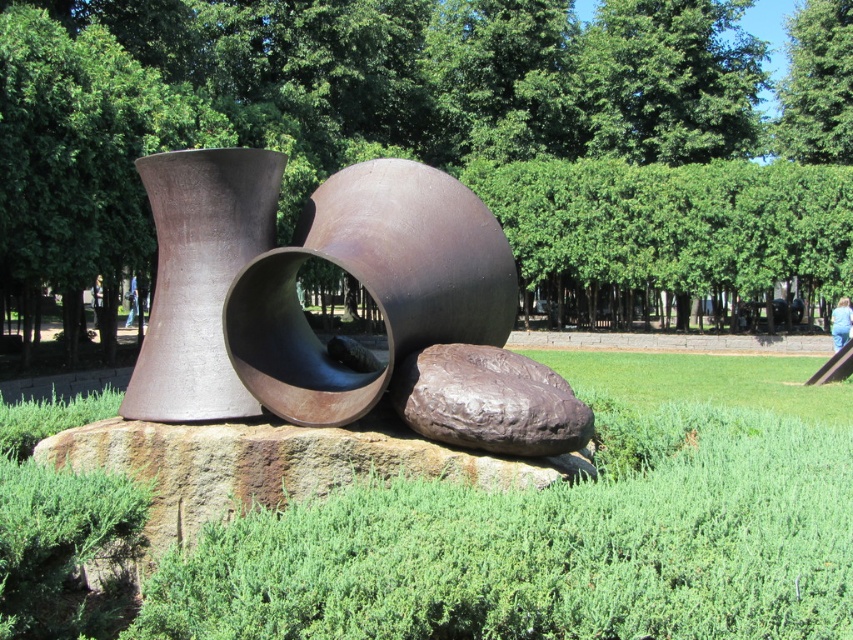
Question: Estimate the real-world distances between objects in this image. Which object is closer to the rusty metal sphere at center?

Choices:
 (A) green leafy tree at center
 (B) matte brown vase at center
 (C) green leafy tree at upper center
 (D) green grass at center

Answer: (B)

Question: Among these objects, which one is farthest from the camera?

Choices:
 (A) rusty metal sphere at center
 (B) green leafy tree at center

Answer: (B)

Question: Is rusty metallic boulder at center to the left of blue jeans at center from the viewer's perspective?

Choices:
 (A) no
 (B) yes

Answer: (A)

Question: Does green grass at center appear under matte brown vase at center?

Choices:
 (A) yes
 (B) no

Answer: (A)

Question: Can you confirm if green grass at center is positioned to the left of blue denim jeans at lower right?

Choices:
 (A) no
 (B) yes

Answer: (B)

Question: Considering the real-world distances, which object is farthest from the blue denim jeans at lower right?

Choices:
 (A) rusty metallic boulder at center
 (B) matte brown vase at center
 (C) blue jeans at center
 (D) green leafy tree at center

Answer: (C)